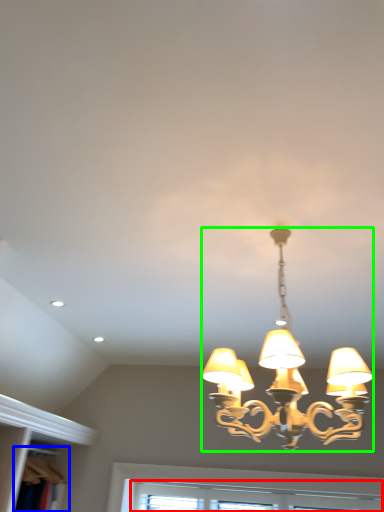
Question: Considering the real-world distances, which object is farthest from window (highlighted by a red box)? bookshelf (highlighted by a blue box) or lamp (highlighted by a green box)?

Choices:
 (A) bookshelf
 (B) lamp

Answer: (A)